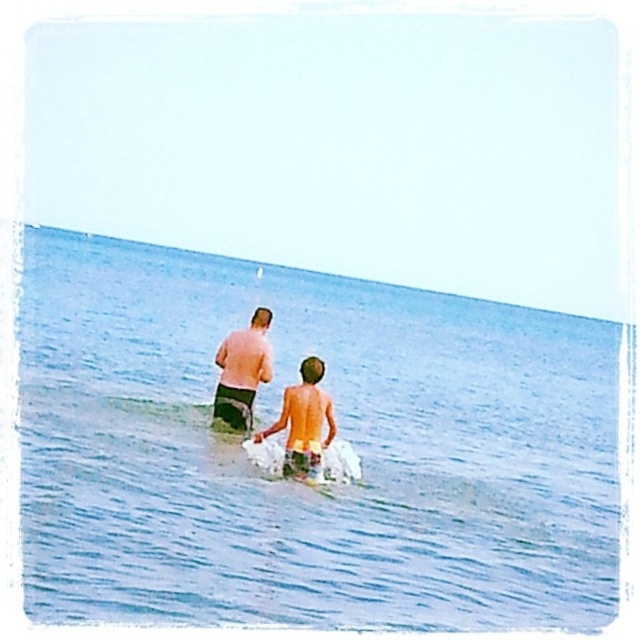
You are a photographer trying to capture the scene of the tan skin boy at center and the blue water at center. Which object in the scene occupies more visual space?

The blue water at center is larger in size than the tan skin boy at center, so the blue water at center occupies more visual space in the scene.

You are a photographer trying to capture the matte black shorts at center in the scene. What are their coordinates?

The coordinates of the matte black shorts at center are at point (x=243, y=371).

You are standing at the beach and see two points marked in the image. Which point is closer to you, point (422,397) or point (241,410)?

Point (241,410) is closer to you because the description states that point (422,397) is further to the camera than point (241,410).